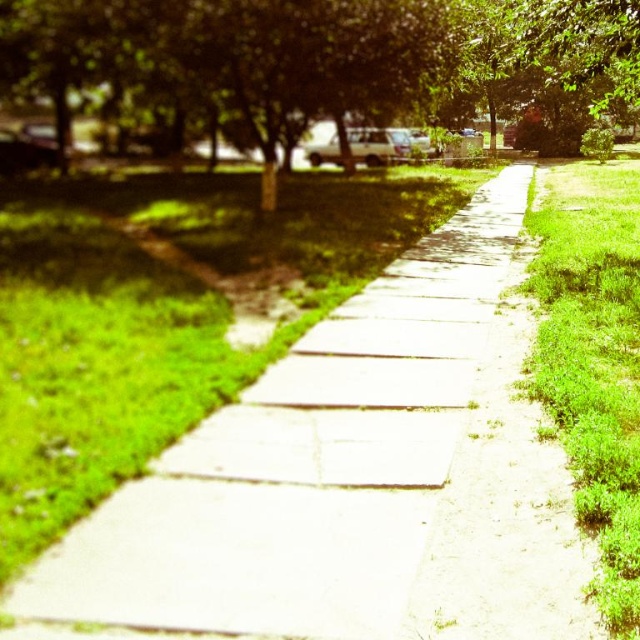
Question: Is green leafy tree at center to the right of green grass at right from the viewer's perspective?

Choices:
 (A) no
 (B) yes

Answer: (A)

Question: Where is green leafy tree at center located in relation to green grass at right in the image?

Choices:
 (A) left
 (B) right

Answer: (A)

Question: Which point appears closest to the camera in this image?

Choices:
 (A) (580, 330)
 (B) (125, 70)

Answer: (A)

Question: Does green leafy tree at center have a smaller size compared to green grass at right?

Choices:
 (A) yes
 (B) no

Answer: (B)